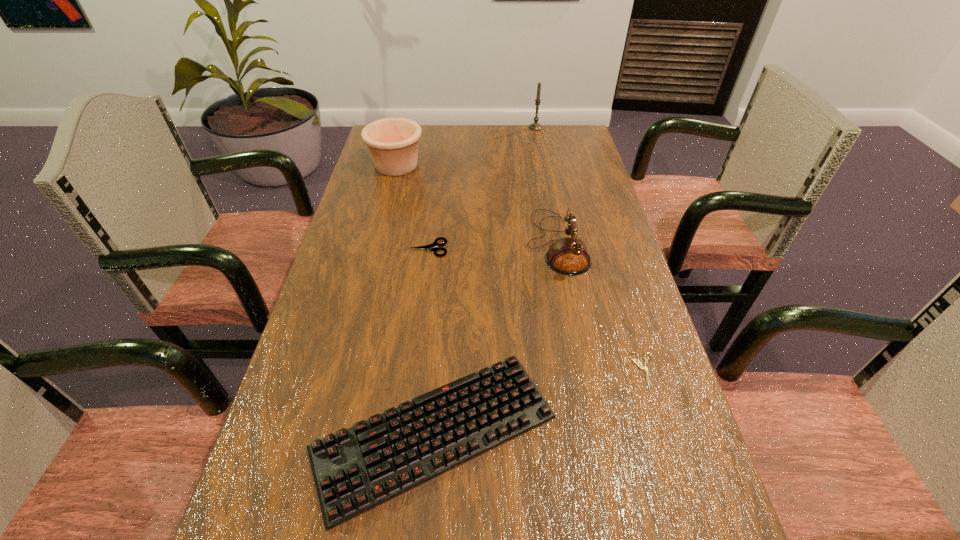
Locate an element on the screen. The image size is (960, 540). computer keyboard located in the left edge section of the desktop is located at coordinates (356, 469).

Where is `candle at the right edge`? The width and height of the screenshot is (960, 540). candle at the right edge is located at coordinates (535, 126).

Identify the location of telephone positioned at the right edge. (569, 256).

The width and height of the screenshot is (960, 540). In order to click on shears situated at the right edge in this screenshot , I will do `click(634, 361)`.

The width and height of the screenshot is (960, 540). Find the location of `object present at the far left corner`. object present at the far left corner is located at coordinates (392, 142).

Identify the location of object that is at the far right corner. The image size is (960, 540). (535, 126).

This screenshot has width=960, height=540. In order to click on vacant space at the far edge of the desktop in this screenshot , I will do `click(447, 147)`.

In the image, there is a desktop. Identify the location of free space at the left edge. The width and height of the screenshot is (960, 540). (378, 343).

This screenshot has height=540, width=960. In order to click on free space at the right edge of the desktop in this screenshot , I will do `click(607, 262)`.

The height and width of the screenshot is (540, 960). Identify the location of free space at the far left corner. (422, 126).